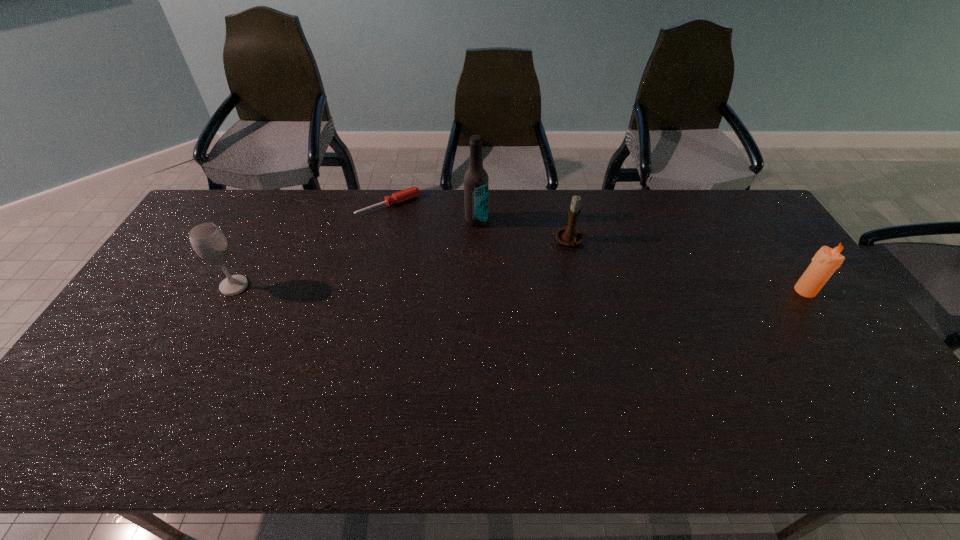
The image size is (960, 540). Find the location of `the leftmost object`. the leftmost object is located at coordinates (208, 241).

Find the location of a particular element. This screenshot has width=960, height=540. candle is located at coordinates (825, 262).

At what (x,y) coordinates should I click in order to perform the action: click on the third object from left to right. Please return your answer as a coordinate pair (x, y). Image resolution: width=960 pixels, height=540 pixels. Looking at the image, I should click on (476, 180).

Find the location of a particular element. The width and height of the screenshot is (960, 540). beer bottle is located at coordinates (476, 180).

The width and height of the screenshot is (960, 540). I want to click on the third nearest object, so click(x=570, y=236).

Where is `candle holder`? The image size is (960, 540). candle holder is located at coordinates pyautogui.click(x=570, y=236).

Image resolution: width=960 pixels, height=540 pixels. Identify the location of screwdriver. (412, 192).

You are a GUI agent. You are given a task and a screenshot of the screen. Output one action in this format:
    pyautogui.click(x=<x>, y=<y>)
    Task: Click on the shortest object
    Image resolution: width=960 pixels, height=540 pixels.
    Given the screenshot: What is the action you would take?
    pyautogui.click(x=412, y=192)

In order to click on free location located on the back of the wineglass in this screenshot , I will do `click(264, 230)`.

The width and height of the screenshot is (960, 540). I want to click on vacant region located on the left of the candle, so click(x=670, y=291).